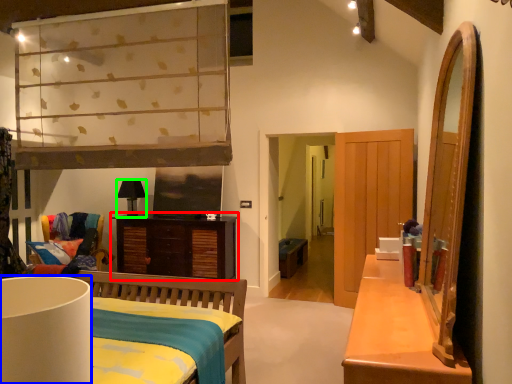
Question: Which object is the closest to the cabinetry (highlighted by a red box)? Choose among these: lamp (highlighted by a blue box) or lamp (highlighted by a green box).

Choices:
 (A) lamp
 (B) lamp

Answer: (B)